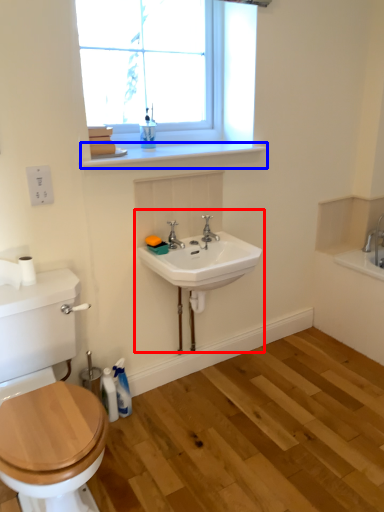
Question: Among these objects, which one is farthest to the camera, sink (highlighted by a red box) or window sill (highlighted by a blue box)?

Choices:
 (A) sink
 (B) window sill

Answer: (B)